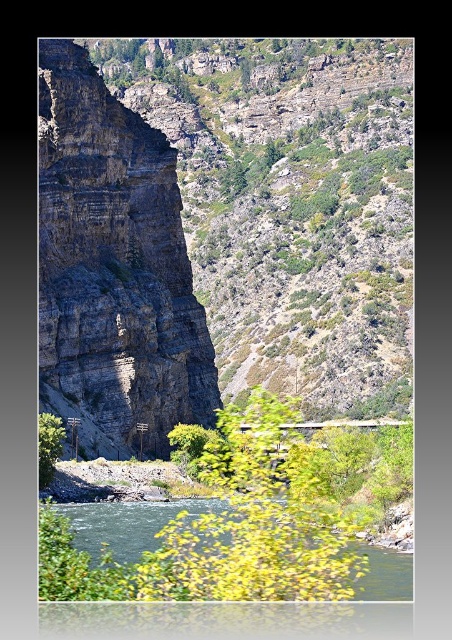
Question: Which point is farther to the camera?

Choices:
 (A) (184, 348)
 (B) (287, 456)
 (C) (382, 598)
 (D) (47, 442)

Answer: (A)

Question: Among these objects, which one is nearest to the camera?

Choices:
 (A) dark gray rocky cliff at left
 (B) green leafy tree at lower left
 (C) green leafy tree at center

Answer: (C)

Question: Among these objects, which one is farthest from the camera?

Choices:
 (A) dark gray rocky cliff at left
 (B) green leafy tree at lower left
 (C) green leafy tree at center
 (D) green smooth water at lower center

Answer: (A)

Question: Is green leafy tree at center above green smooth water at lower center?

Choices:
 (A) yes
 (B) no

Answer: (A)

Question: Is dark gray rocky cliff at left bigger than green leafy tree at lower left?

Choices:
 (A) no
 (B) yes

Answer: (B)

Question: Is green leafy tree at center bigger than green smooth water at lower center?

Choices:
 (A) no
 (B) yes

Answer: (B)